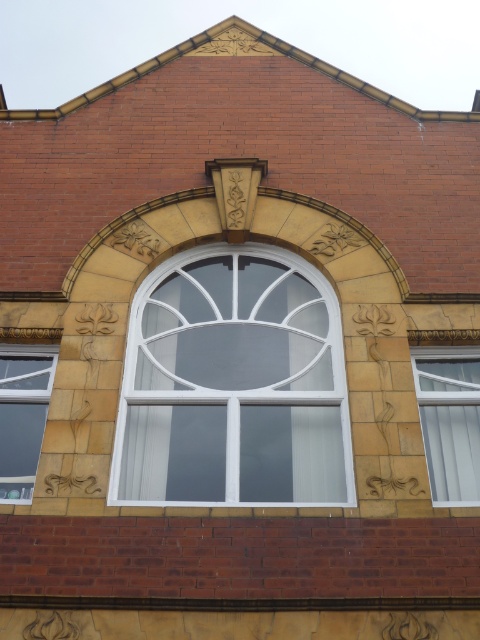
You are standing in front of a building and want to take a photo of the white glass window at center. If your camera can focus on objects up to 70 feet away, will you need to move closer to get a clear shot?

The white glass window at center is 73.88 feet away from the viewer. Since the camera can only focus up to 70 feet, you need to move closer to ensure the white glass window at center is within the camera range.

You are an architect reviewing building plans. You notice two windows in the design. The white plastic window at right and the clear glass window at lower left. Which window has a greater height?

The clear glass window at lower left is taller than the white plastic window at right.